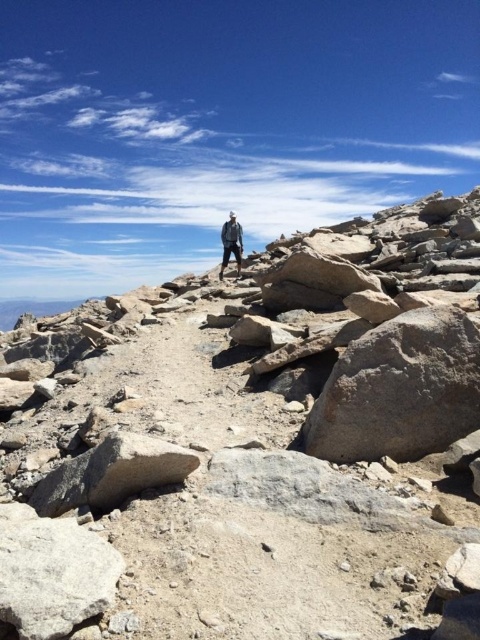
Which is more to the right, gray rock at center or denim jacket at center?

From the viewer's perspective, gray rock at center appears more on the right side.

Is gray rock at center in front of denim jacket at center?

Yes.

Is point (379, 497) in front of point (239, 225)?

That is True.

This screenshot has height=640, width=480. Identify the location of gray rock at center. (251, 445).